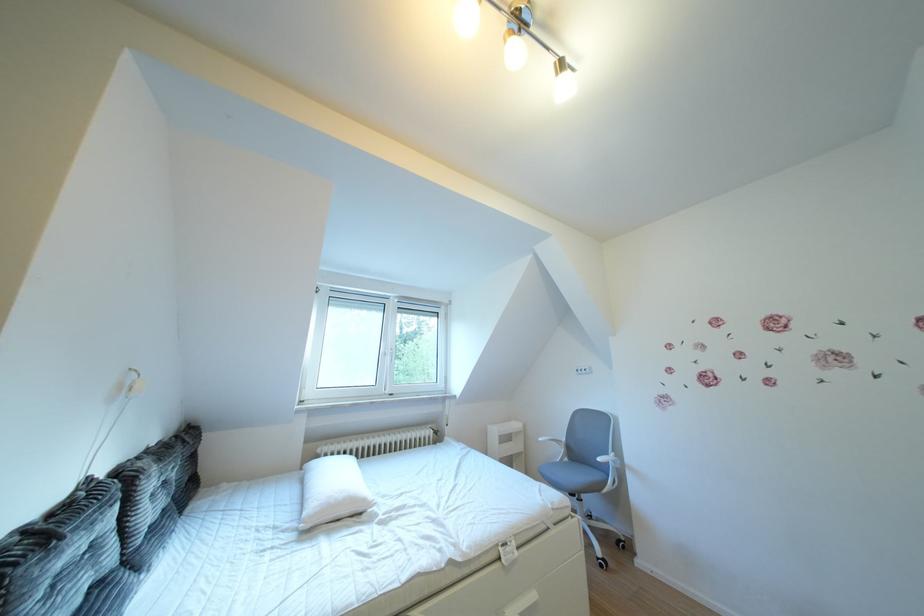
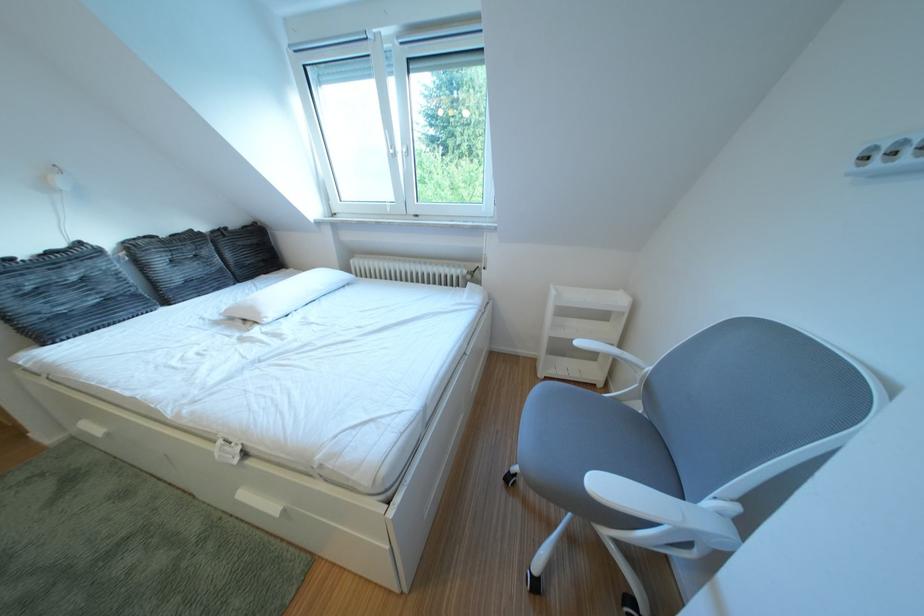
Locate, in the second image, the point that corresponds to point (103, 485) in the first image.

(93, 249)